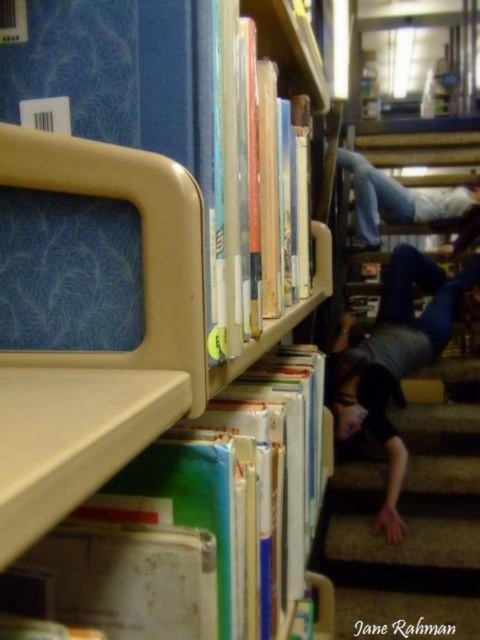
Which is in front, point (225, 250) or point (423, 308)?

Point (225, 250)

Does hardcover book at upper center have a smaller size compared to dark gray shirt at lower right?

Correct, hardcover book at upper center occupies less space than dark gray shirt at lower right.

Between point (230, 323) and point (395, 451), which one is positioned behind?

The point (395, 451) is behind.

The image size is (480, 640). Find the location of `hardcover book at upper center`. hardcover book at upper center is located at coordinates (245, 184).

Between hardcover book at upper center and blue jeans at upper right, which one is positioned higher?

Positioned higher is blue jeans at upper right.

Who is taller, hardcover book at upper center or blue jeans at upper right?

A: With more height is blue jeans at upper right.

Which is behind, point (226, 259) or point (355, 192)?

Point (355, 192)

Identify the location of hardcover book at upper center. (245, 184).

Is point (88, 259) in front of point (233, 337)?

Yes, point (88, 259) is closer to viewer.

Who is lower down, matte plastic bookcase at center or hardcover book at upper center?

matte plastic bookcase at center is below.

Describe the element at coordinates (106, 307) in the screenshot. I see `matte plastic bookcase at center` at that location.

Locate an element on the screen. This screenshot has width=480, height=640. matte plastic bookcase at center is located at coordinates (106, 307).